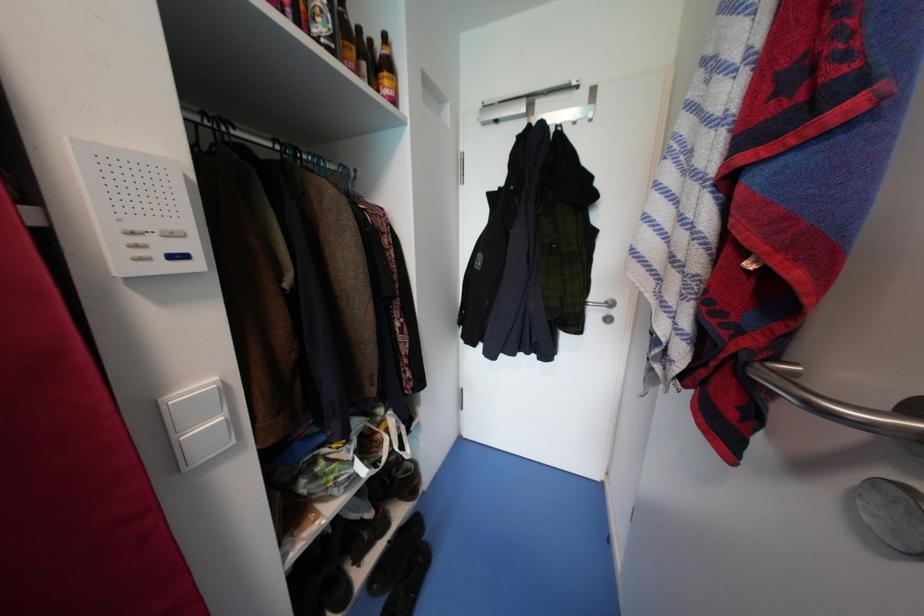
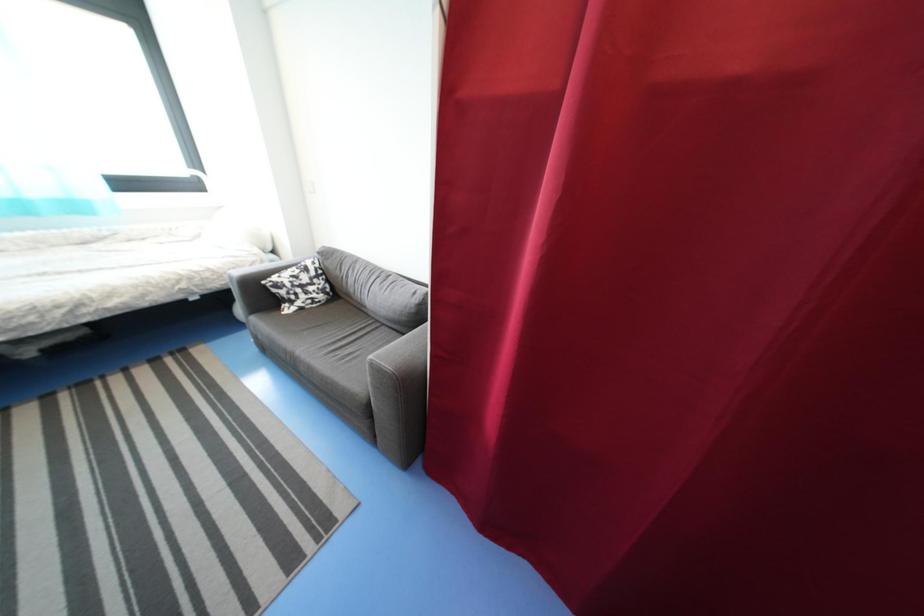
Based on the continuous images, in which direction is the camera rotating?

The rotation direction of the camera is left-down.